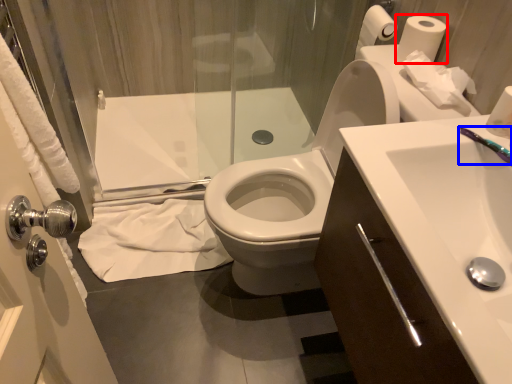
Question: Which of the following is the closest to the observer, toilet paper (highlighted by a red box) or toothbrush (highlighted by a blue box)?

Choices:
 (A) toilet paper
 (B) toothbrush

Answer: (B)